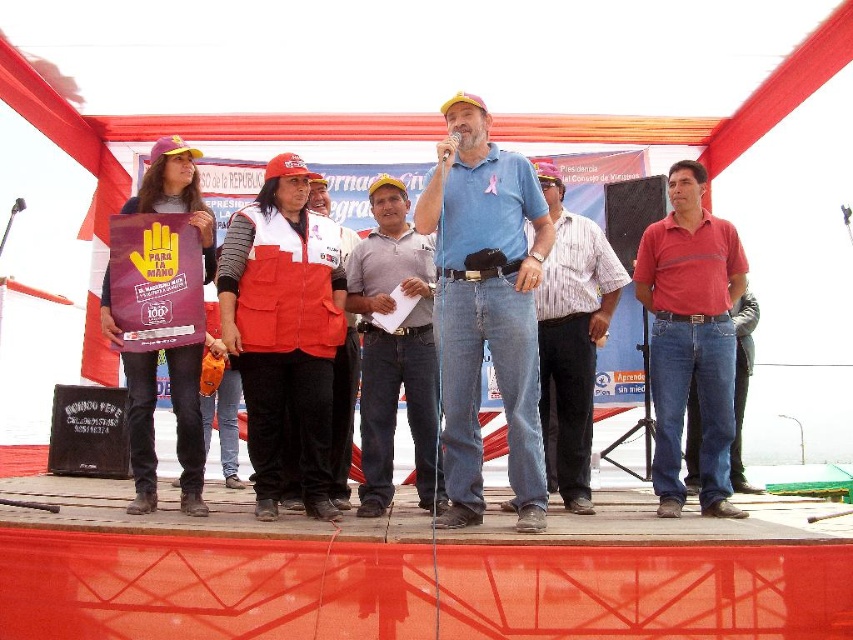
Can you confirm if red cotton shirt at right is thinner than striped cotton shirt at center?

Correct, red cotton shirt at right's width is less than striped cotton shirt at center's.

Is point (691, 356) positioned after point (599, 324)?

No, (691, 356) is in front of (599, 324).

Where is `red cotton shirt at right`? The width and height of the screenshot is (853, 640). red cotton shirt at right is located at coordinates (691, 337).

Who is more forward, (566, 236) or (352, 353)?

Point (352, 353) is more forward.

Which of these two, striped cotton shirt at center or velvet red vest at center, stands taller?

With more height is striped cotton shirt at center.

Does point (569, 342) come farther from viewer compared to point (337, 349)?

Yes, point (569, 342) is farther from viewer.

Identify the location of striped cotton shirt at center. (572, 339).

Which is below, red cotton shirt at right or gray cotton shirt at center?

gray cotton shirt at center is lower down.

Find the location of `red cotton shirt at right`. red cotton shirt at right is located at coordinates (691, 337).